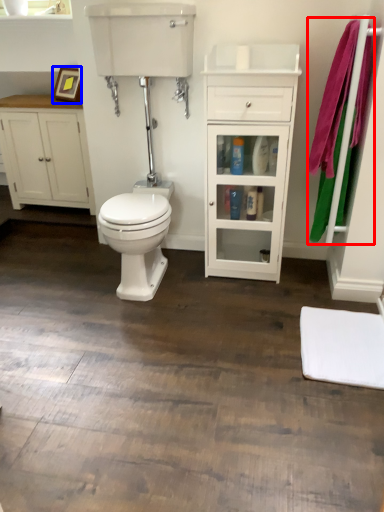
Question: Which of the following is the closest to the observer, bath towel (highlighted by a red box) or picture frame (highlighted by a blue box)?

Choices:
 (A) bath towel
 (B) picture frame

Answer: (A)